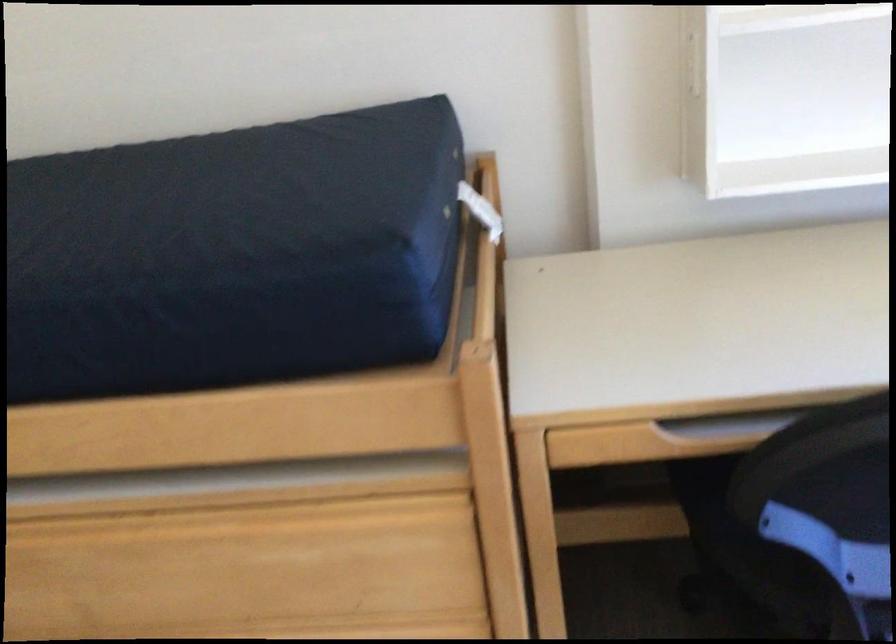
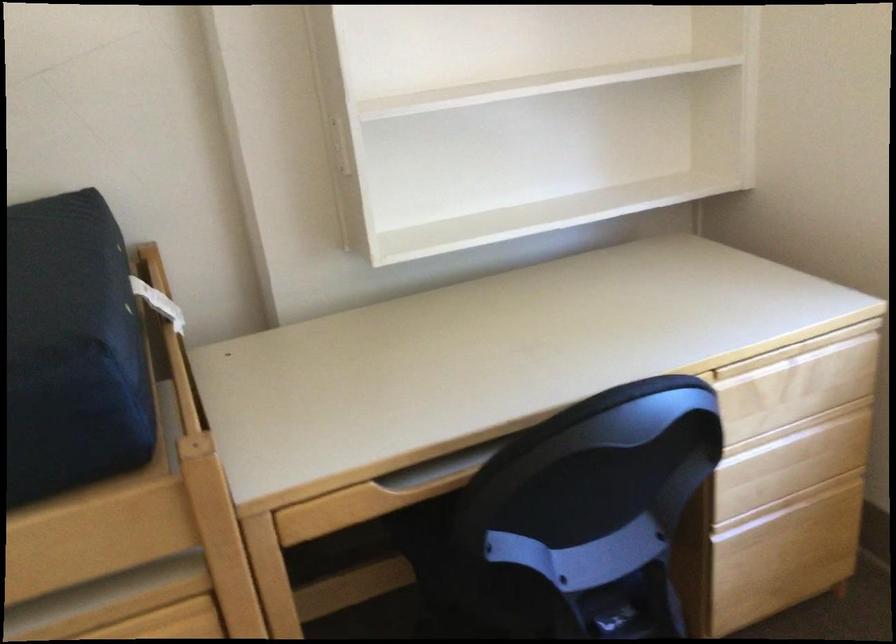
Question: The camera is either moving clockwise (left) or counter-clockwise (right) around the object. The first image is from the beginning of the video and the second image is from the end. Is the camera moving left or right when shooting the video?

Choices:
 (A) Left
 (B) Right

Answer: (A)